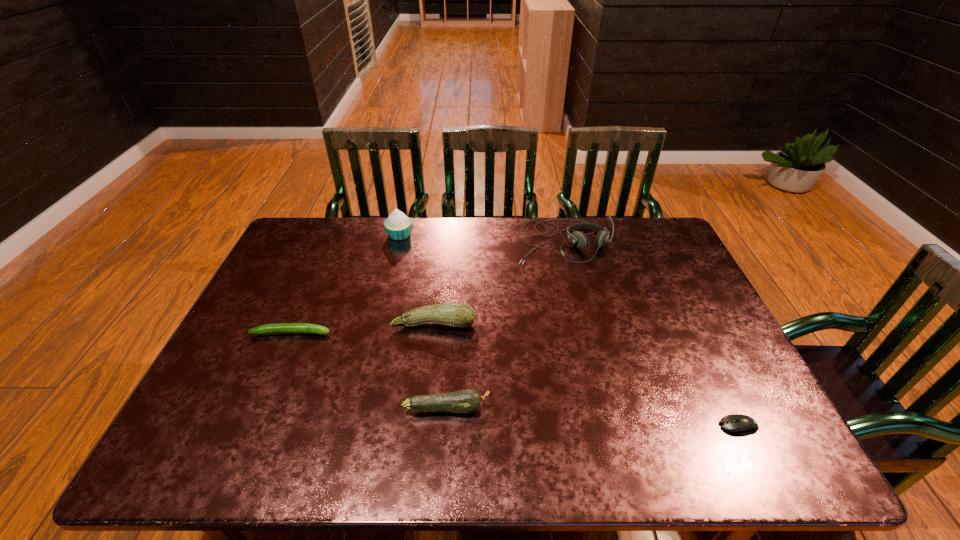
In order to click on free spot between the headset and the computer mouse in this screenshot , I will do `click(651, 334)`.

I want to click on vacant area between the fifth tallest object and the fifth object from left to right, so click(x=427, y=287).

Locate an element on the screen. The width and height of the screenshot is (960, 540). free space that is in between the fourth tallest object and the shortest zucchini is located at coordinates (370, 370).

Find the location of a particular element. free space that is in between the second tallest object and the third tallest object is located at coordinates (499, 282).

Where is `blank region between the fourth shortest object and the fifth tallest object`? blank region between the fourth shortest object and the fifth tallest object is located at coordinates (363, 328).

Identify the location of vacant space that's between the rightmost object and the fifth shortest object. This screenshot has width=960, height=540. (651, 334).

At what (x,y) coordinates should I click in order to perform the action: click on unoccupied area between the headset and the shortest zucchini. Please return your answer as a coordinate pair (x, y). The width and height of the screenshot is (960, 540). Looking at the image, I should click on (427, 287).

Where is `vacant area that lies between the fifth object from left to right and the fourth shortest object`? vacant area that lies between the fifth object from left to right and the fourth shortest object is located at coordinates (499, 282).

Where is `object that stands as the third closest to the second tallest zucchini`? object that stands as the third closest to the second tallest zucchini is located at coordinates (579, 239).

In order to click on the closest object to the second object from right to left in this screenshot , I will do `click(453, 314)`.